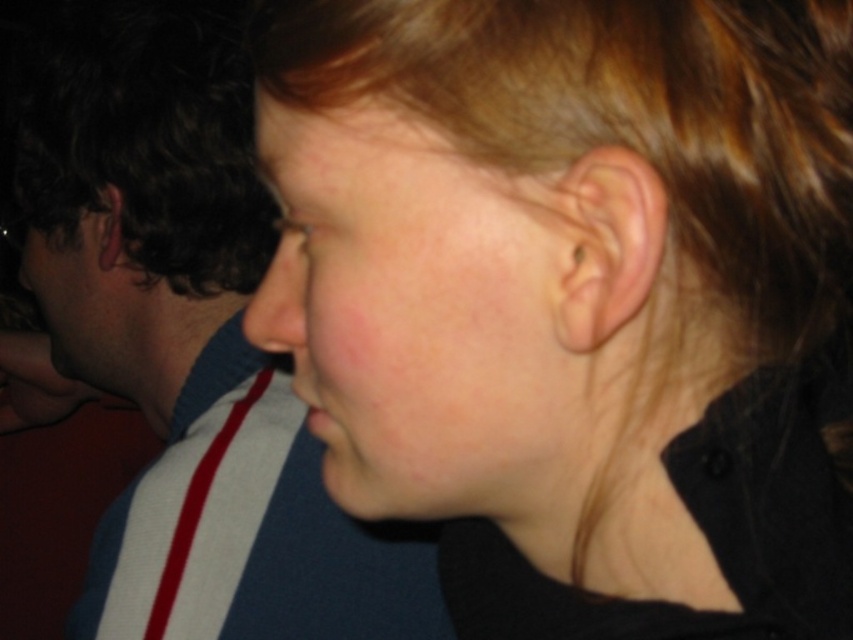
Can you confirm if smooth skin at center is positioned below matte skin nose at center?

Correct, smooth skin at center is located below matte skin nose at center.

Who is more forward, (517, 356) or (294, 230)?

Point (517, 356) is in front.

Measure the distance between smooth skin at center and camera.

They are 10.82 inches apart.

Locate an element on the screen. Image resolution: width=853 pixels, height=640 pixels. smooth skin at center is located at coordinates (419, 314).

Who is lower down, matte blue shirt at left or smooth skin at center?

matte blue shirt at left is below.

Looking at this image, can you confirm if matte blue shirt at left is taller than smooth skin at center?

Yes, matte blue shirt at left is taller than smooth skin at center.

Is point (90, 563) behind point (488, 364)?

Yes, point (90, 563) is farther from viewer.

The image size is (853, 640). I want to click on matte blue shirt at left, so click(x=189, y=342).

Is smooth skin face at center further to camera compared to matte blue shirt at left?

No, smooth skin face at center is in front of matte blue shirt at left.

Which is more to the left, smooth skin face at center or matte blue shirt at left?

Positioned to the left is matte blue shirt at left.

Is point (407, 355) closer to camera compared to point (200, 77)?

That is True.

What are the coordinates of `smooth skin face at center` in the screenshot? It's located at (579, 300).